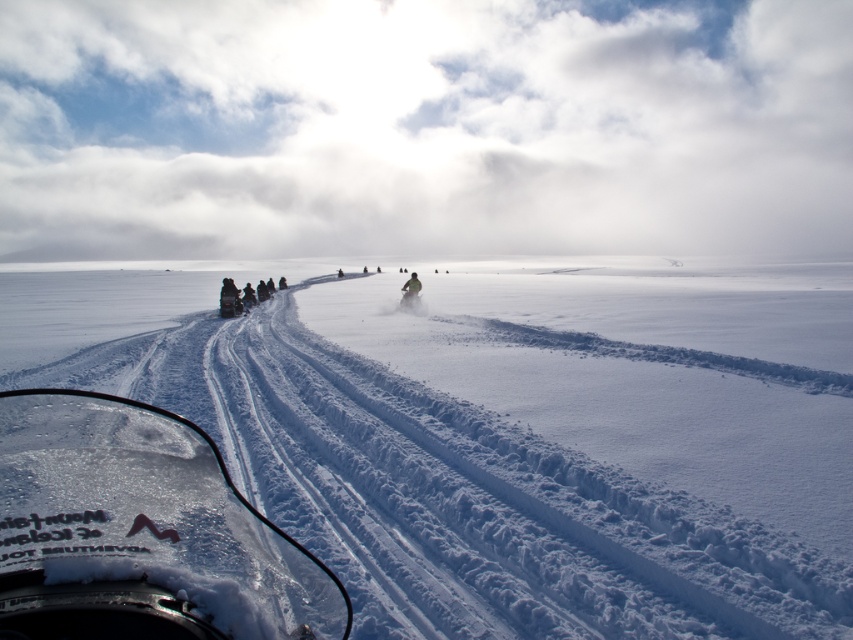
Does green matte snowmobile at center appear on the left side of green fabric jacket at center?

In fact, green matte snowmobile at center is to the right of green fabric jacket at center.

Is point (418, 296) positioned in front of point (410, 282)?

Yes, it is.

Is point (422, 301) more distant than point (415, 285)?

No, (422, 301) is in front of (415, 285).

At what (x,y) coordinates should I click in order to perform the action: click on green matte snowmobile at center. Please return your answer as a coordinate pair (x, y). Image resolution: width=853 pixels, height=640 pixels. Looking at the image, I should click on (410, 301).

Is green matte snowmobile at center positioned in front of matte black snowmobile at center?

Yes, green matte snowmobile at center is in front of matte black snowmobile at center.

Does green matte snowmobile at center have a lesser height compared to matte black snowmobile at center?

No.

Between point (409, 300) and point (239, 308), which one is positioned in front?

Point (409, 300) is in front.

Where is `green matte snowmobile at center`? green matte snowmobile at center is located at coordinates (410, 301).

Describe the element at coordinates (239, 298) in the screenshot. I see `dark gray snowmobile at center` at that location.

Is dark gray snowmobile at center to the left of green fabric jacket at center from the viewer's perspective?

Correct, you'll find dark gray snowmobile at center to the left of green fabric jacket at center.

Is point (230, 291) positioned before point (405, 298)?

That is False.

You are a GUI agent. You are given a task and a screenshot of the screen. Output one action in this format:
    pyautogui.click(x=<x>, y=<y>)
    Task: Click on the dark gray snowmobile at center
    This screenshot has height=640, width=853.
    Given the screenshot: What is the action you would take?
    pyautogui.click(x=239, y=298)